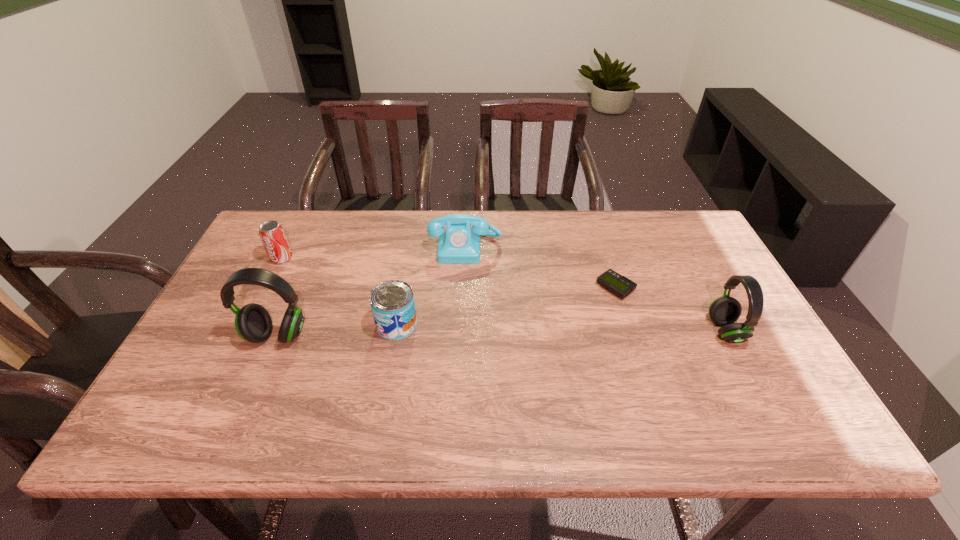
In order to click on free space between the telephone and the soda can in this screenshot , I will do `click(373, 253)`.

This screenshot has height=540, width=960. In order to click on free area in between the soda can and the second object from right to left in this screenshot , I will do `click(448, 273)`.

You are a GUI agent. You are given a task and a screenshot of the screen. Output one action in this format:
    pyautogui.click(x=<x>, y=<y>)
    Task: Click on the free space between the fifth object from left to right and the telephone
    This screenshot has height=540, width=960.
    Given the screenshot: What is the action you would take?
    pyautogui.click(x=540, y=268)

Locate an element on the screen. The width and height of the screenshot is (960, 540). vacant point located between the soda can and the left headset is located at coordinates (279, 297).

Identify the location of unoccupied area between the fifth shortest object and the third farthest object. Image resolution: width=960 pixels, height=540 pixels. (670, 309).

The width and height of the screenshot is (960, 540). In order to click on free space that is in between the soda can and the left headset in this screenshot , I will do `click(279, 297)`.

I want to click on object identified as the third closest to the left headset, so click(460, 244).

Choose which object is the third nearest neighbor to the telephone. Please provide its 2D coordinates. Your answer should be formatted as a tuple, i.e. [(x, y)], where the tuple contains the x and y coordinates of a point satisfying the conditions above.

[(253, 323)]

In order to click on vacant position in the image that satisfies the following two spatial constraints: 1. on the ear cups of the right headset; 2. on the ear cups of the taller headset in this screenshot , I will do `click(728, 335)`.